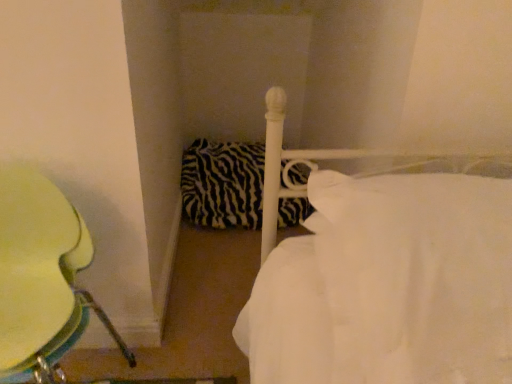
The width and height of the screenshot is (512, 384). What do you see at coordinates (388, 285) in the screenshot?
I see `white smooth bed at center` at bounding box center [388, 285].

Image resolution: width=512 pixels, height=384 pixels. Identify the location of white smooth bed at center. (388, 285).

This screenshot has width=512, height=384. What do you see at coordinates (42, 278) in the screenshot? I see `metallic green chair at left` at bounding box center [42, 278].

The height and width of the screenshot is (384, 512). Find the location of `zebra-patterned fabric pillow at center`. zebra-patterned fabric pillow at center is located at coordinates (223, 184).

Is zebra-patterned fabric pillow at center to the left or to the right of metallic green chair at left in the image?

zebra-patterned fabric pillow at center is to the right of metallic green chair at left.

Consider the image. Considering the positions of objects zebra-patterned fabric pillow at center and metallic green chair at left in the image provided, who is behind, zebra-patterned fabric pillow at center or metallic green chair at left?

zebra-patterned fabric pillow at center is more distant.

Considering the relative sizes of zebra-patterned fabric pillow at center and metallic green chair at left in the image provided, is zebra-patterned fabric pillow at center taller than metallic green chair at left?

In fact, zebra-patterned fabric pillow at center may be shorter than metallic green chair at left.

Based on the photo, considering the sizes of objects white smooth bed at center and zebra-patterned fabric pillow at center in the image provided, who is bigger, white smooth bed at center or zebra-patterned fabric pillow at center?

zebra-patterned fabric pillow at center.

How much distance is there between white smooth bed at center and zebra-patterned fabric pillow at center?

3.94 feet.

From a real-world perspective, is white smooth bed at center on zebra-patterned fabric pillow at center?

Indeed, from a real-world perspective, white smooth bed at center stands above zebra-patterned fabric pillow at center.

Considering the sizes of objects white smooth bed at center and zebra-patterned fabric pillow at center in the image provided, who is thinner, white smooth bed at center or zebra-patterned fabric pillow at center?

white smooth bed at center is thinner.

Who is bigger, metallic green chair at left or zebra-patterned fabric pillow at center?

Bigger between the two is metallic green chair at left.

At what (x,y) coordinates should I click in order to perform the action: click on pillow behind the metallic green chair at left. Please return your answer as a coordinate pair (x, y). Looking at the image, I should click on (223, 184).

Is metallic green chair at left looking in the opposite direction of zebra-patterned fabric pillow at center?

No, metallic green chair at left is not facing the opposite direction of zebra-patterned fabric pillow at center.

What's the angular difference between metallic green chair at left and zebra-patterned fabric pillow at center's facing directions?

0.398 degrees separate the facing orientations of metallic green chair at left and zebra-patterned fabric pillow at center.

Is zebra-patterned fabric pillow at center positioned far away from white smooth bed at center?

Absolutely, zebra-patterned fabric pillow at center is distant from white smooth bed at center.

Is zebra-patterned fabric pillow at center in front of white smooth bed at center?

No, zebra-patterned fabric pillow at center is further to the viewer.

Locate an element on the screen. pillow above the white smooth bed at center (from the image's perspective) is located at coordinates (223, 184).

Based on their sizes in the image, would you say zebra-patterned fabric pillow at center is bigger or smaller than white smooth bed at center?

Considering their sizes, zebra-patterned fabric pillow at center takes up more space than white smooth bed at center.

Are white smooth bed at center and metallic green chair at left beside each other?

white smooth bed at center is not next to metallic green chair at left, and they're not touching.

From the image's perspective, is white smooth bed at center beneath metallic green chair at left?

Actually, white smooth bed at center appears above metallic green chair at left in the image.

Is the depth of white smooth bed at center less than that of metallic green chair at left?

Yes, white smooth bed at center is in front of metallic green chair at left.

Would you say metallic green chair at left is inside or outside white smooth bed at center?

metallic green chair at left is located beyond the bounds of white smooth bed at center.

At what (x,y) coordinates should I click in order to perform the action: click on furniture located on the left of white smooth bed at center. Please return your answer as a coordinate pair (x, y). Looking at the image, I should click on (42, 278).

Based on the photo, is metallic green chair at left directly adjacent to white smooth bed at center?

No, metallic green chair at left is not in contact with white smooth bed at center.

From the picture: Is metallic green chair at left aimed at white smooth bed at center?

No, metallic green chair at left is not turned towards white smooth bed at center.

Find the location of a particular element. This screenshot has height=384, width=512. furniture located on the left of zebra-patterned fabric pillow at center is located at coordinates (42, 278).

Locate an element on the screen. bed to the right of zebra-patterned fabric pillow at center is located at coordinates (388, 285).

From the image, which object appears to be nearer to metallic green chair at left, zebra-patterned fabric pillow at center or white smooth bed at center?

white smooth bed at center.

Looking at this image, based on their spatial positions, is white smooth bed at center or zebra-patterned fabric pillow at center further from metallic green chair at left?

The object further to metallic green chair at left is zebra-patterned fabric pillow at center.

Which object lies nearer to the anchor point white smooth bed at center, zebra-patterned fabric pillow at center or metallic green chair at left?

metallic green chair at left.

When comparing their distances from zebra-patterned fabric pillow at center, does metallic green chair at left or white smooth bed at center seem further?

white smooth bed at center lies further to zebra-patterned fabric pillow at center than the other object.

Considering their positions, is metallic green chair at left positioned further to white smooth bed at center than zebra-patterned fabric pillow at center?

zebra-patterned fabric pillow at center.

When comparing their distances from zebra-patterned fabric pillow at center, does white smooth bed at center or metallic green chair at left seem further?

Among the two, white smooth bed at center is located further to zebra-patterned fabric pillow at center.

Find the location of a particular element. furniture located between white smooth bed at center and zebra-patterned fabric pillow at center in the depth direction is located at coordinates (42, 278).